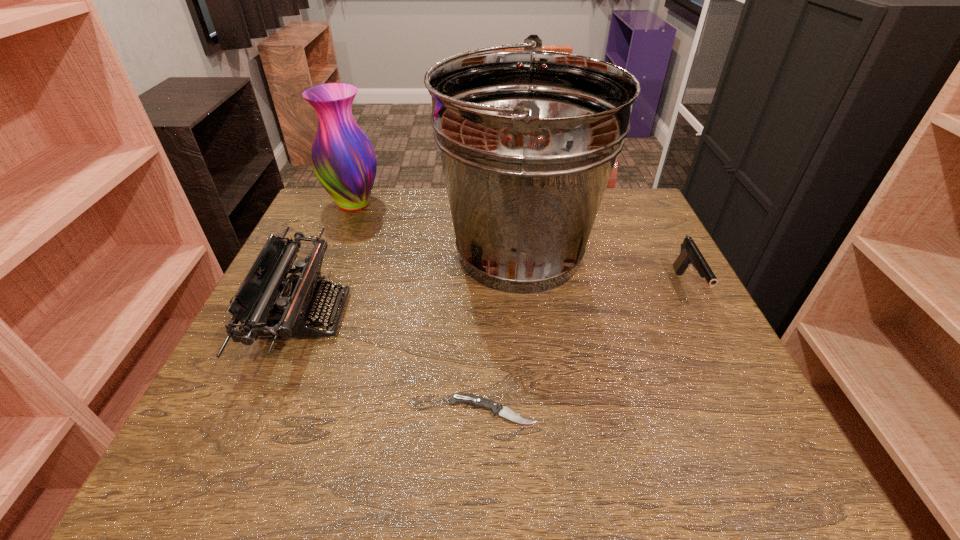
Where is `free area in between the nearest object and the bucket`? The image size is (960, 540). free area in between the nearest object and the bucket is located at coordinates (505, 332).

Identify the location of unoccupied position between the nearest object and the bucket. (x=505, y=332).

The width and height of the screenshot is (960, 540). What are the coordinates of `free point between the third tallest object and the nearest object` in the screenshot? It's located at (398, 363).

Locate an element on the screen. This screenshot has width=960, height=540. free space that is in between the tallest object and the vase is located at coordinates (436, 228).

You are a GUI agent. You are given a task and a screenshot of the screen. Output one action in this format:
    pyautogui.click(x=<x>, y=<y>)
    Task: Click on the blank region between the vase and the nearest object
    The height and width of the screenshot is (540, 960).
    Given the screenshot: What is the action you would take?
    pyautogui.click(x=422, y=307)

You are a GUI agent. You are given a task and a screenshot of the screen. Output one action in this format:
    pyautogui.click(x=<x>, y=<y>)
    Task: Click on the free space between the tallest object and the shortest object
    
    Given the screenshot: What is the action you would take?
    pyautogui.click(x=505, y=332)

Locate an element on the screen. Image resolution: width=960 pixels, height=540 pixels. free space between the pistol and the third shortest object is located at coordinates click(x=496, y=301).

Identify which object is the second nearest to the tallest object. Please provide its 2D coordinates. Your answer should be formatted as a tuple, i.e. [(x, y)], where the tuple contains the x and y coordinates of a point satisfying the conditions above.

[(343, 159)]

Locate an element on the screen. object that is the fourth closest to the pistol is located at coordinates (343, 159).

Locate an element on the screen. The width and height of the screenshot is (960, 540). vacant region that satisfies the following two spatial constraints: 1. on the typing side of the shortest object; 2. on the left side of the typewriter is located at coordinates (266, 411).